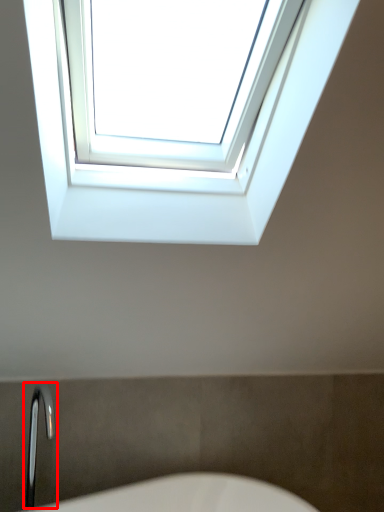
Question: From the image, what is the correct spatial relationship of faucet (annotated by the red box) in relation to window?

Choices:
 (A) left
 (B) right

Answer: (A)